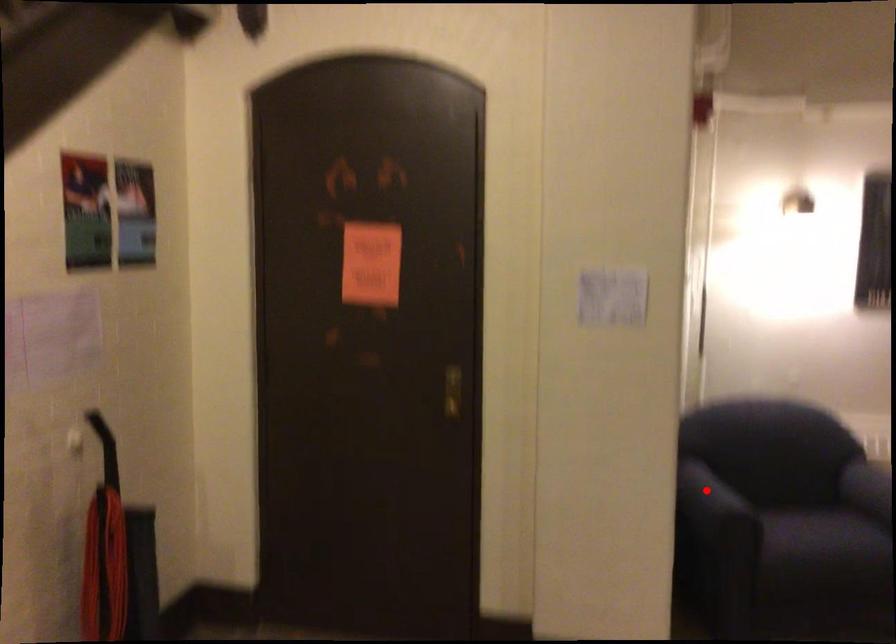
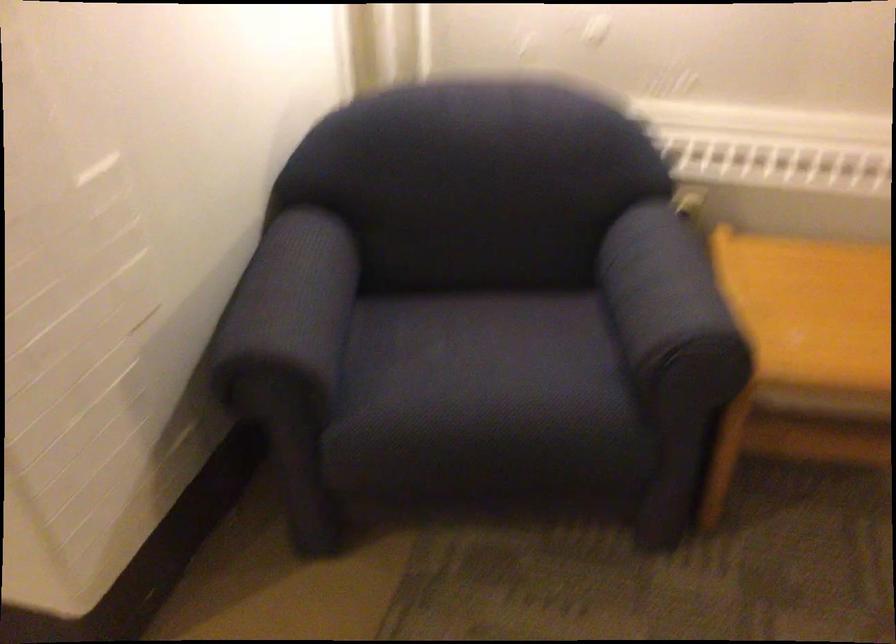
Question: A red point is marked in image1. In image2, is the corresponding 3D point closer to the camera or farther? Reply with the corresponding letter.

Choices:
 (A) The corresponding 3D point is closer.
 (B) The corresponding 3D point is farther.

Answer: (A)